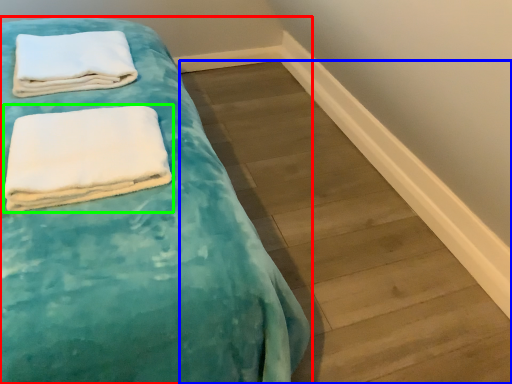
Question: Based on their relative distances, which object is farther from bed (highlighted by a red box)? Choose from plank (highlighted by a blue box) and towel (highlighted by a green box).

Choices:
 (A) plank
 (B) towel

Answer: (A)